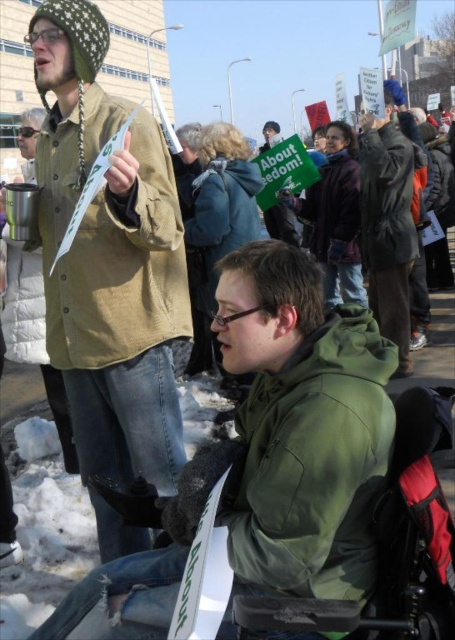
Who is higher up, tan canvas jacket at upper left or green quilted jacket at upper left?

Positioned higher is tan canvas jacket at upper left.

Who is more forward, [85,305] or [43,289]?

Positioned in front is point [85,305].

At what (x,y) coordinates should I click in order to perform the action: click on tan canvas jacket at upper left. Please return your answer as a coordinate pair (x, y). Image resolution: width=455 pixels, height=640 pixels. Looking at the image, I should click on (111, 252).

Which is in front, point (161, 225) or point (267, 225)?

Positioned in front is point (161, 225).

The width and height of the screenshot is (455, 640). What do you see at coordinates (111, 252) in the screenshot? I see `tan canvas jacket at upper left` at bounding box center [111, 252].

Who is more distant from viewer, (134, 314) or (281, 224)?

The point (281, 224) is behind.

You are a GUI agent. You are given a task and a screenshot of the screen. Output one action in this format:
    pyautogui.click(x=<x>, y=<y>)
    Task: Click on the tan canvas jacket at upper left
    
    Given the screenshot: What is the action you would take?
    pyautogui.click(x=111, y=252)

Is point (76, 444) positioned before point (271, 214)?

That is True.

Locate an element on the screen. This screenshot has width=455, height=640. matte brown jacket at upper left is located at coordinates (109, 259).